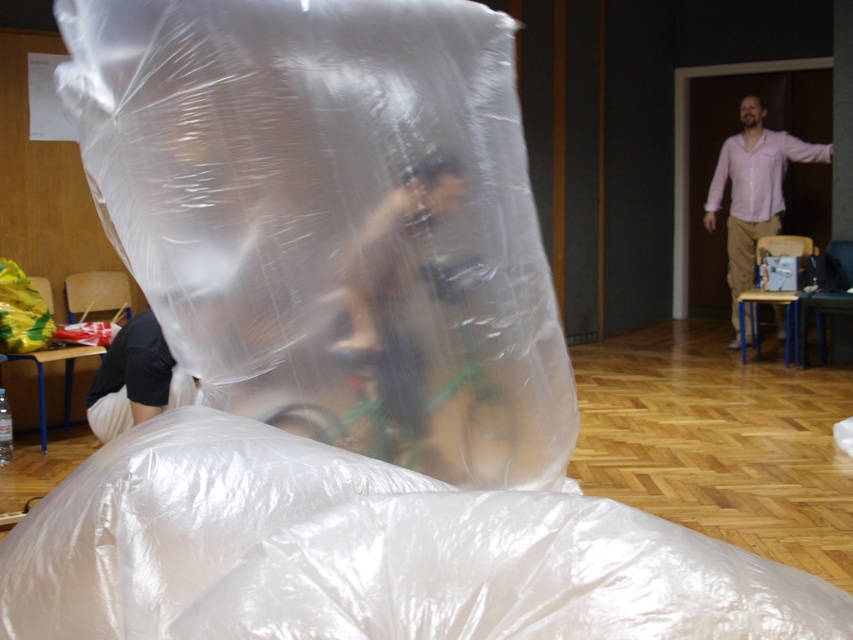
Is point (503, 253) positioned after point (729, 260)?

No, it is in front of (729, 260).

Describe the element at coordinates (334, 220) in the screenshot. I see `transparent plastic bag at center` at that location.

Locate an element on the screen. The width and height of the screenshot is (853, 640). transparent plastic bag at center is located at coordinates (334, 220).

Between green metallic bicycle at center and pink shirt at right, which one has more height?

Standing taller between the two is pink shirt at right.

Can you confirm if green metallic bicycle at center is thinner than pink shirt at right?

Yes, green metallic bicycle at center is thinner than pink shirt at right.

Who is more distant from viewer, (486, 401) or (724, 161)?

The point (724, 161) is behind.

What are the coordinates of `green metallic bicycle at center` in the screenshot? It's located at (409, 410).

Can you confirm if transparent plastic bag at center is bigger than brown leather jacket at center?

Indeed, transparent plastic bag at center has a larger size compared to brown leather jacket at center.

Who is more forward, (84, 154) or (387, 380)?

Point (84, 154) is more forward.

Is point (422, 445) less distant than point (386, 333)?

That is False.

At what (x,y) coordinates should I click in order to perform the action: click on transparent plastic bag at center. Please return your answer as a coordinate pair (x, y). This screenshot has height=640, width=853. Looking at the image, I should click on (334, 220).